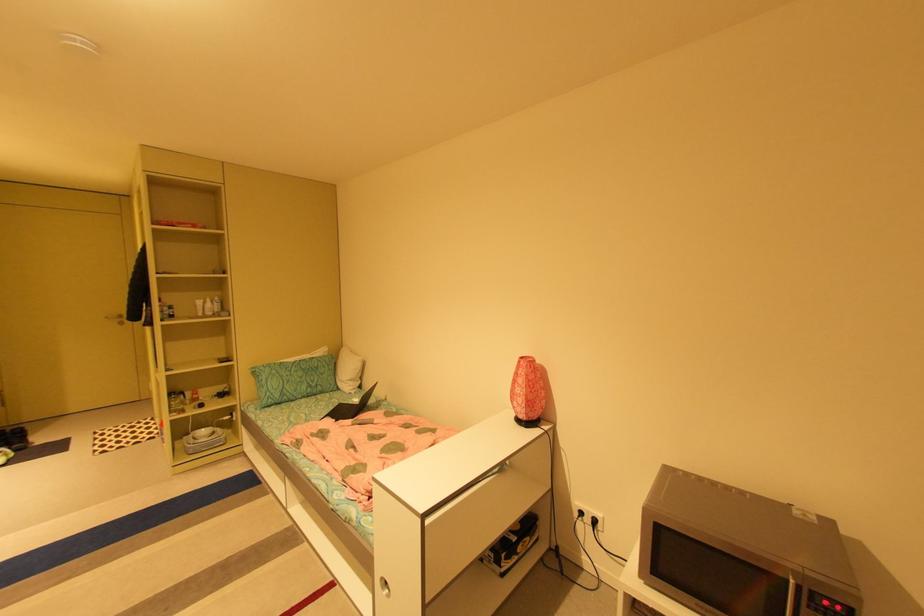
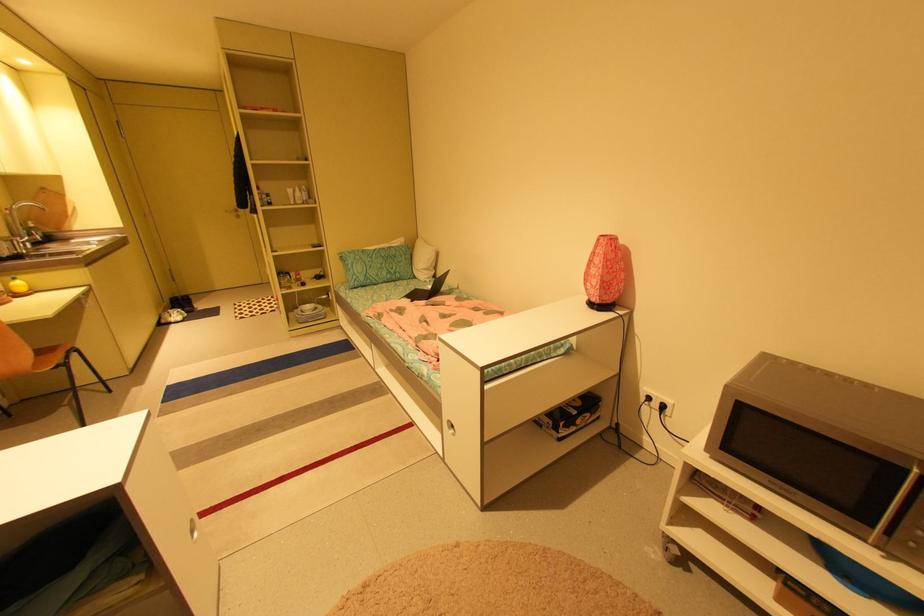
Find the pixel in the second image that matches point (601, 522) in the first image.

(669, 407)